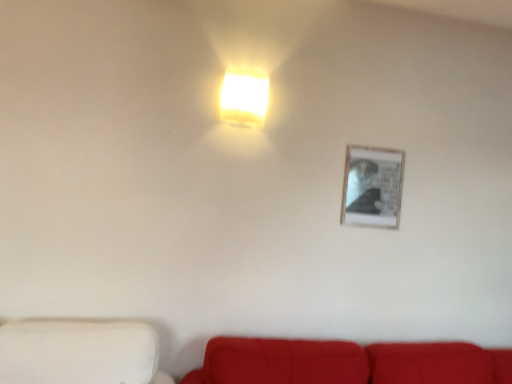
Question: From a real-world perspective, is white matte wall at lower left located beneath velvet red couch at lower center?

Choices:
 (A) no
 (B) yes

Answer: (A)

Question: Is white matte wall at lower left behind velvet red couch at lower center?

Choices:
 (A) no
 (B) yes

Answer: (A)

Question: Considering the relative positions of white matte wall at lower left and velvet red couch at lower center in the image provided, is white matte wall at lower left in front of velvet red couch at lower center?

Choices:
 (A) no
 (B) yes

Answer: (B)

Question: Would you say velvet red couch at lower center is part of white matte wall at lower left's contents?

Choices:
 (A) no
 (B) yes

Answer: (A)

Question: Could you tell me if white matte wall at lower left is turned towards velvet red couch at lower center?

Choices:
 (A) yes
 (B) no

Answer: (B)

Question: Can you confirm if white matte wall at lower left is taller than velvet red couch at lower center?

Choices:
 (A) yes
 (B) no

Answer: (B)

Question: Is white matte wall at lower left at the left side of matte white square at upper center?

Choices:
 (A) no
 (B) yes

Answer: (B)

Question: Does white matte wall at lower left appear on the right side of matte white square at upper center?

Choices:
 (A) no
 (B) yes

Answer: (A)

Question: Can you confirm if white matte wall at lower left is taller than matte white square at upper center?

Choices:
 (A) yes
 (B) no

Answer: (B)

Question: Considering the relative sizes of white matte wall at lower left and matte white square at upper center in the image provided, is white matte wall at lower left smaller than matte white square at upper center?

Choices:
 (A) yes
 (B) no

Answer: (B)

Question: From a real-world perspective, is white matte wall at lower left physically below matte white square at upper center?

Choices:
 (A) no
 (B) yes

Answer: (B)

Question: Can you confirm if white matte wall at lower left is wider than matte white square at upper center?

Choices:
 (A) yes
 (B) no

Answer: (A)

Question: Are velvet red couch at lower center and matte white square at upper center far apart?

Choices:
 (A) yes
 (B) no

Answer: (A)